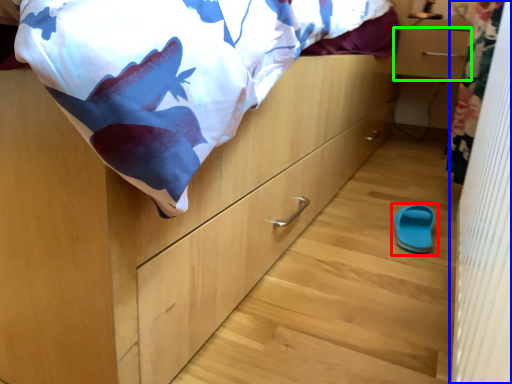
Question: Which object is positioned closest to footwear (highlighted by a red box)? Select from curtain (highlighted by a blue box) and drawer (highlighted by a green box).

Choices:
 (A) curtain
 (B) drawer

Answer: (A)